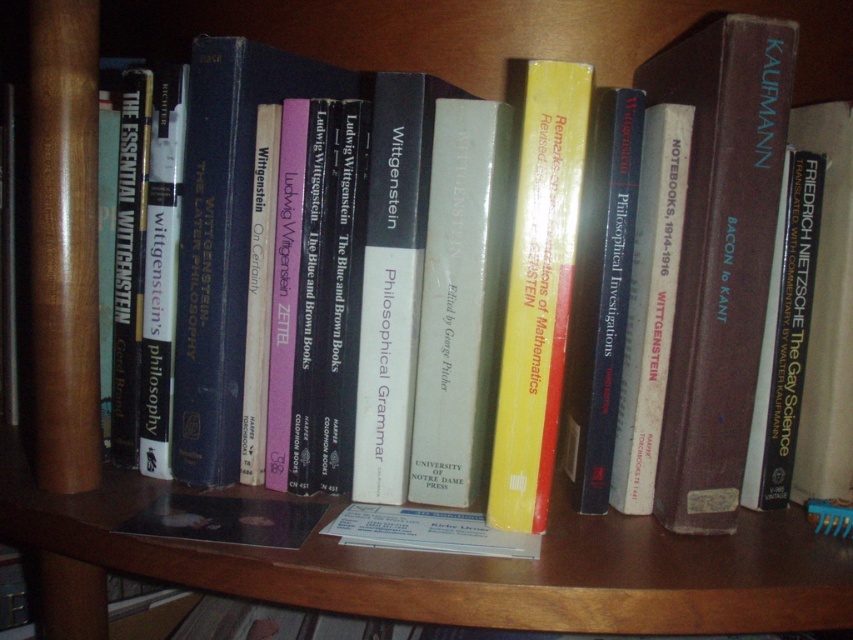
Does brown leather book at center appear on the left side of yellow matte book at center?

Incorrect, brown leather book at center is not on the left side of yellow matte book at center.

Can you confirm if brown leather book at center is positioned to the right of yellow matte book at center?

Yes, brown leather book at center is to the right of yellow matte book at center.

Is point (695, 74) farther from camera compared to point (518, 448)?

Yes, it is behind point (518, 448).

Locate an element on the screen. The height and width of the screenshot is (640, 853). brown leather book at center is located at coordinates (720, 256).